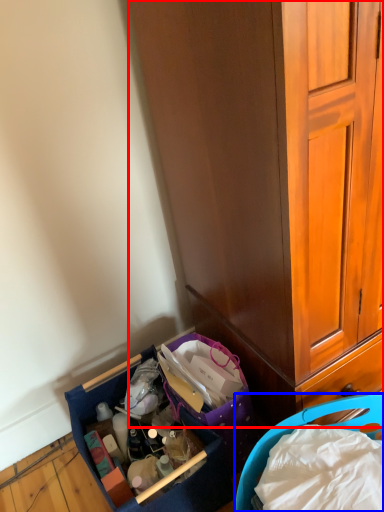
Question: Which point is further to the camera, cabinetry (highlighted by a red box) or picnic basket (highlighted by a blue box)?

Choices:
 (A) cabinetry
 (B) picnic basket

Answer: (B)